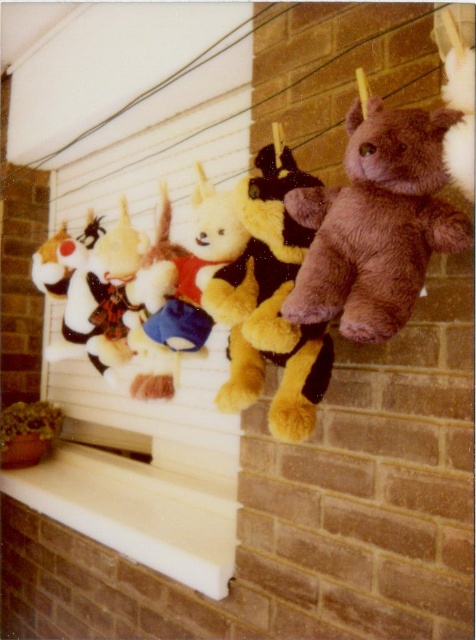
Is point (334, 204) in front of point (57, 477)?

Yes, point (334, 204) is in front of point (57, 477).

Does brown plush bear at upper right appear under white smooth ledge at lower center?

Actually, brown plush bear at upper right is above white smooth ledge at lower center.

Who is more forward, (308, 221) or (188, 449)?

Point (308, 221)

Image resolution: width=476 pixels, height=640 pixels. Find the location of `brown plush bear at upper right`. brown plush bear at upper right is located at coordinates (376, 224).

Does brown plush bear at upper right appear on the right side of fluffy white teddy bear at center?

Correct, you'll find brown plush bear at upper right to the right of fluffy white teddy bear at center.

Is brown plush bear at upper right thinner than fluffy white teddy bear at center?

Correct, brown plush bear at upper right's width is less than fluffy white teddy bear at center's.

Does point (379, 108) come farther from viewer compared to point (158, 227)?

No, (379, 108) is closer to viewer.

At what (x,y) coordinates should I click in order to perform the action: click on brown plush bear at upper right. Please return your answer as a coordinate pair (x, y). The width and height of the screenshot is (476, 640). Looking at the image, I should click on (376, 224).

The image size is (476, 640). Describe the element at coordinates (376, 224) in the screenshot. I see `brown plush bear at upper right` at that location.

Between brown plush bear at upper right and fuzzy brown teddy bear at center, which one has less height?

brown plush bear at upper right

In the scene shown: Measure the distance between brown plush bear at upper right and camera.

brown plush bear at upper right is 76.08 centimeters from camera.

You are a GUI agent. You are given a task and a screenshot of the screen. Output one action in this format:
    pyautogui.click(x=<x>, y=<y>)
    Task: Click on the brown plush bear at upper right
    The height and width of the screenshot is (640, 476).
    Given the screenshot: What is the action you would take?
    pyautogui.click(x=376, y=224)